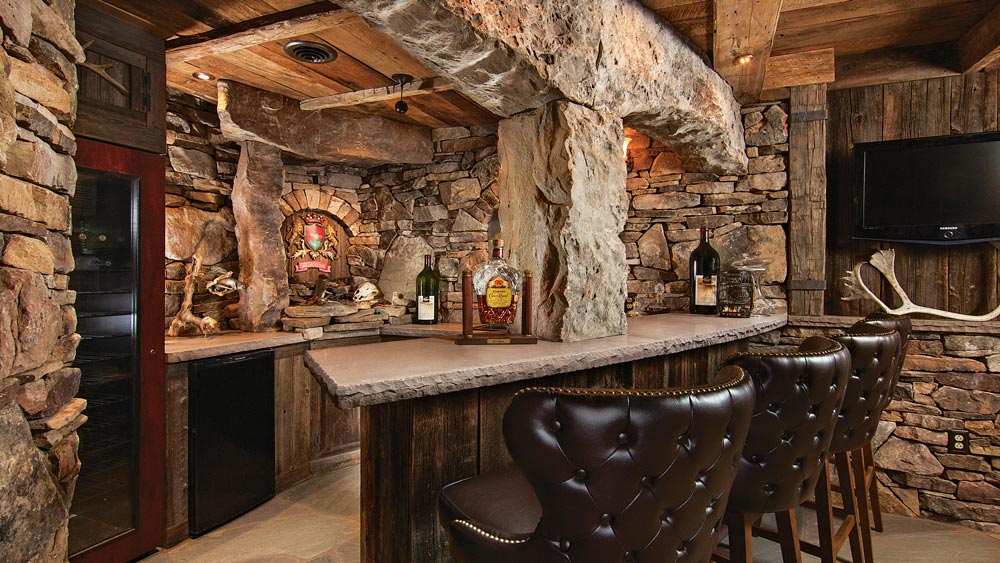
In order to click on vent in this screenshot , I will do `click(308, 53)`.